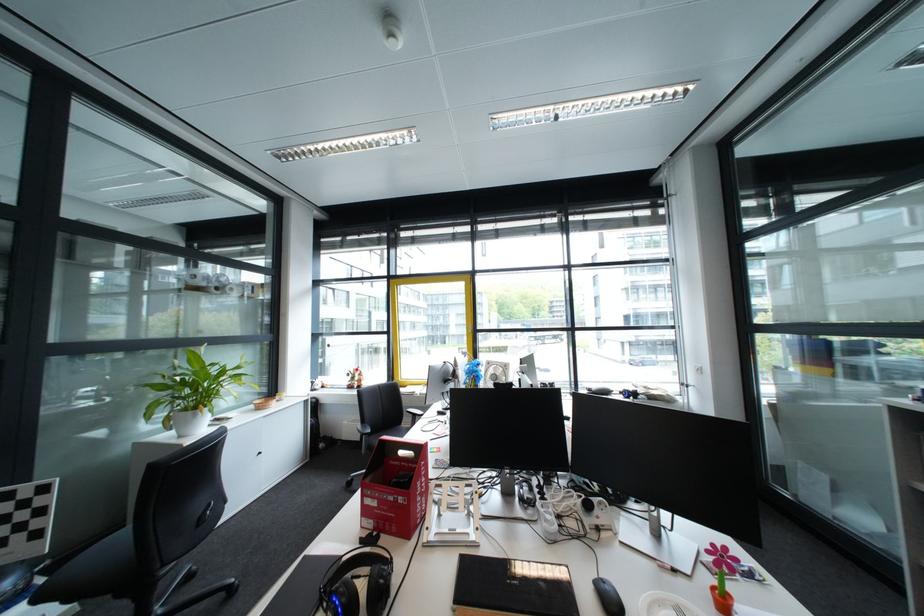
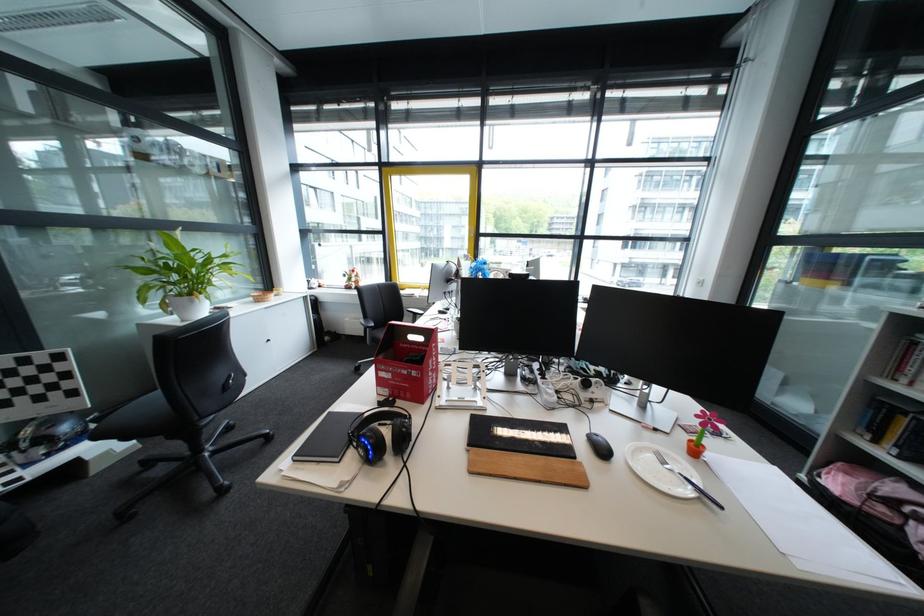
Find the pixel in the second image that matches (x=209, y=416) in the first image.

(207, 302)